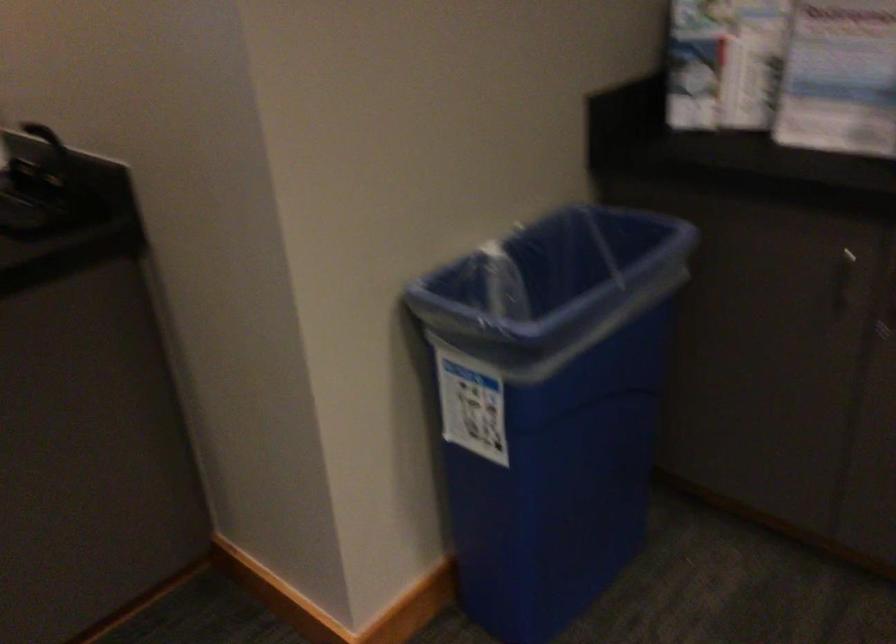
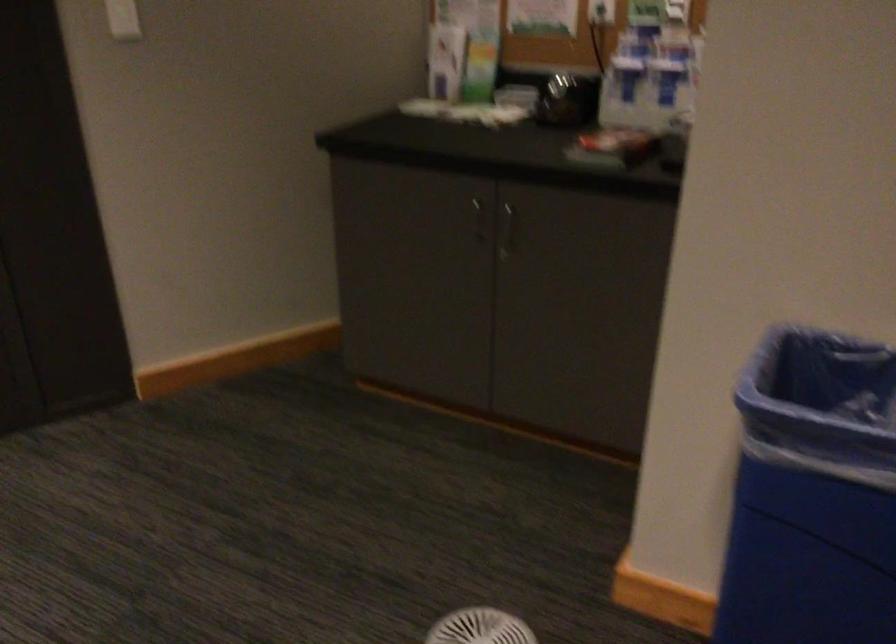
How did the camera likely rotate?

The rotation direction of the camera is left-down.